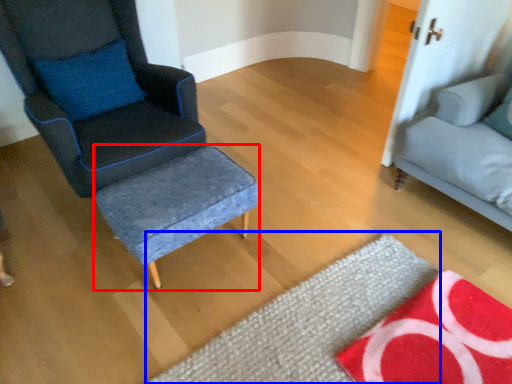
Question: Which object is closer to the camera taking this photo, stool (highlighted by a red box) or mat (highlighted by a blue box)?

Choices:
 (A) stool
 (B) mat

Answer: (B)